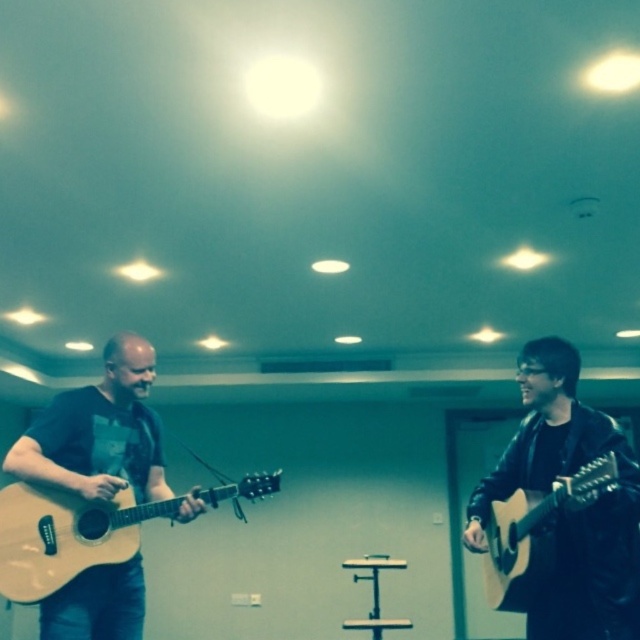
Question: Is matte black guitar at left positioned in front of light brown acoustic guitar at left?

Choices:
 (A) yes
 (B) no

Answer: (B)

Question: Which point is farther from the camera taking this photo?

Choices:
 (A) (529, 384)
 (B) (227, 496)
 (C) (538, 504)
 (D) (81, 464)

Answer: (B)

Question: Based on their relative distances, which object is farther from the matte black guitar at right?

Choices:
 (A) light brown acoustic guitar at left
 (B) matte black guitar at left
 (C) matte brown acoustic guitar at right

Answer: (B)

Question: Is matte black guitar at left positioned behind light brown acoustic guitar at left?

Choices:
 (A) no
 (B) yes

Answer: (B)

Question: Considering the real-world distances, which object is closest to the matte black guitar at right?

Choices:
 (A) light brown acoustic guitar at left
 (B) matte black guitar at left
 (C) matte brown acoustic guitar at right

Answer: (C)

Question: Is light brown acoustic guitar at left wider than matte brown acoustic guitar at right?

Choices:
 (A) no
 (B) yes

Answer: (B)